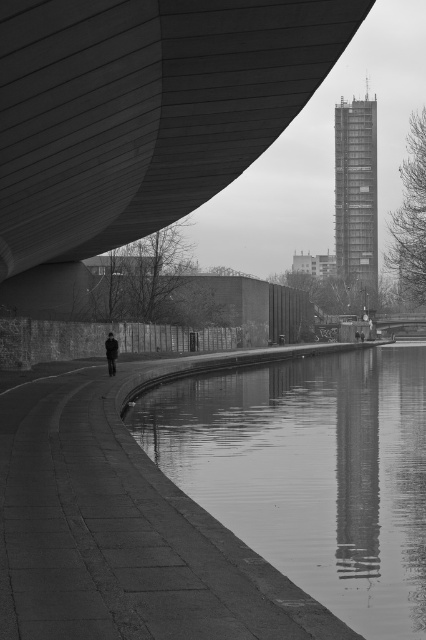
Can you confirm if smooth concrete river at center is positioned above dark gray fabric jacket at lower center?

Actually, smooth concrete river at center is below dark gray fabric jacket at lower center.

Can you confirm if smooth concrete river at center is wider than dark gray fabric jacket at lower center?

Yes.

Identify the location of smooth concrete river at center. (311, 474).

Where is `smooth concrete river at center`? This screenshot has height=640, width=426. smooth concrete river at center is located at coordinates [311, 474].

Which is more to the left, smooth concrete bridge at upper left or smooth concrete river at center?

smooth concrete bridge at upper left

Does point (172, 84) lie behind point (244, 456)?

No, it is not.

Which is in front, point (187, 147) or point (342, 524)?

Positioned in front is point (342, 524).

This screenshot has width=426, height=640. Find the location of `smooth concrete bridge at upper left`. smooth concrete bridge at upper left is located at coordinates (143, 109).

Can you confirm if smooth concrete bridge at upper left is taller than dark gray fabric jacket at lower center?

Incorrect, smooth concrete bridge at upper left's height is not larger of dark gray fabric jacket at lower center's.

You are a GUI agent. You are given a task and a screenshot of the screen. Output one action in this format:
    pyautogui.click(x=<x>, y=<y>)
    Task: Click on the smooth concrete bridge at upper left
    
    Given the screenshot: What is the action you would take?
    pyautogui.click(x=143, y=109)